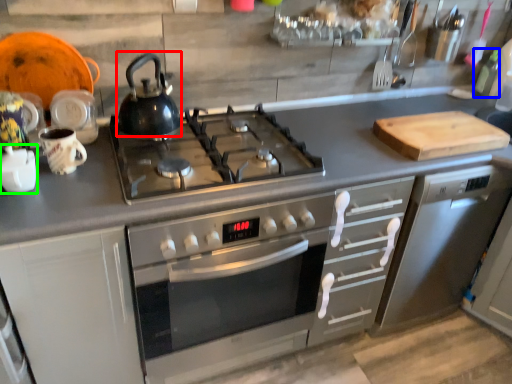
Question: Which object is the farthest from kettle (highlighted by a red box)? Choose among these: bottle (highlighted by a blue box) or appliance (highlighted by a green box).

Choices:
 (A) bottle
 (B) appliance

Answer: (A)